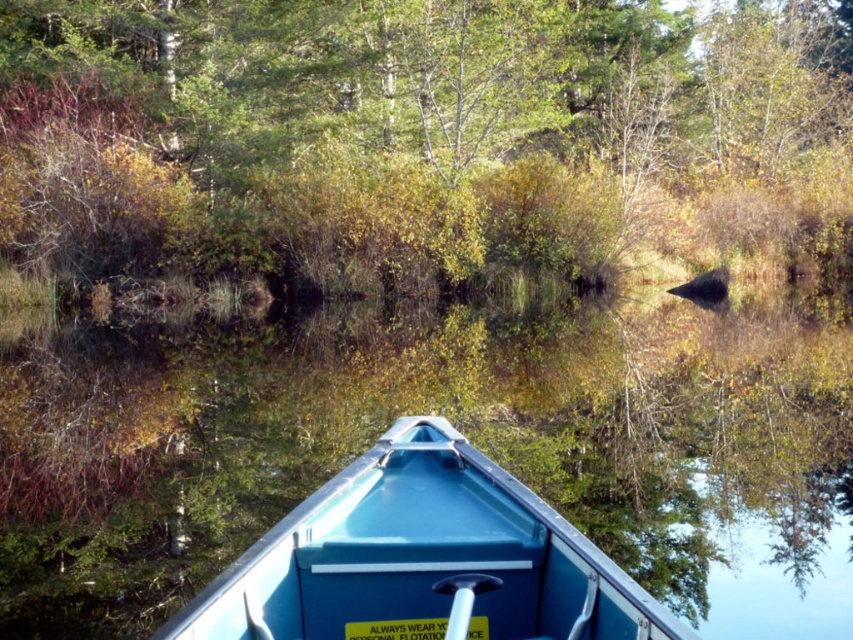
You are in a blue plastic boat at center and want to reach a green leafy tree at upper center. Considering their heights, which one is taller?

The green leafy tree at upper center is taller than the blue plastic boat at center.

You are in a blue canoe and want to navigate towards the green leafy tree at upper center. Based on your current position, which direction should you steer the canoe to reach it?

The green leafy tree at upper center is located at point coordinates of 0.212 on the x axis and 0.490 on the y axis. Since the bow of the canoe is pointing towards the dense forested area, which is where the tree is situated, you should continue moving forward in the direction the canoe is already facing to reach the green leafy tree at upper center.

You are sitting in the blue plastic boat at center and want to look at the green leafy tree at upper center. Which direction should you turn your head to see it?

The green leafy tree at upper center is to the right of the blue plastic boat at center, so you should turn your head to the right to see it.